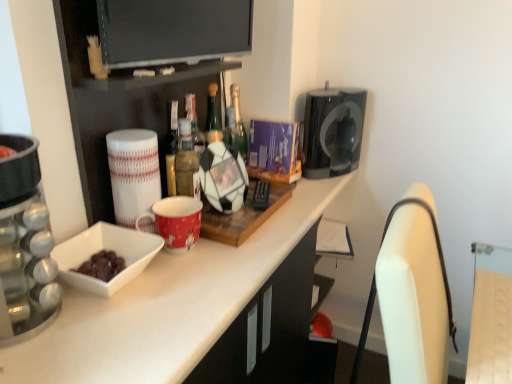
This screenshot has width=512, height=384. What are the coordinates of `free region under black glossy coffee machine at upper right, the 2th appliance viewed from the left (from a real-world perspective)` in the screenshot? It's located at (327, 172).